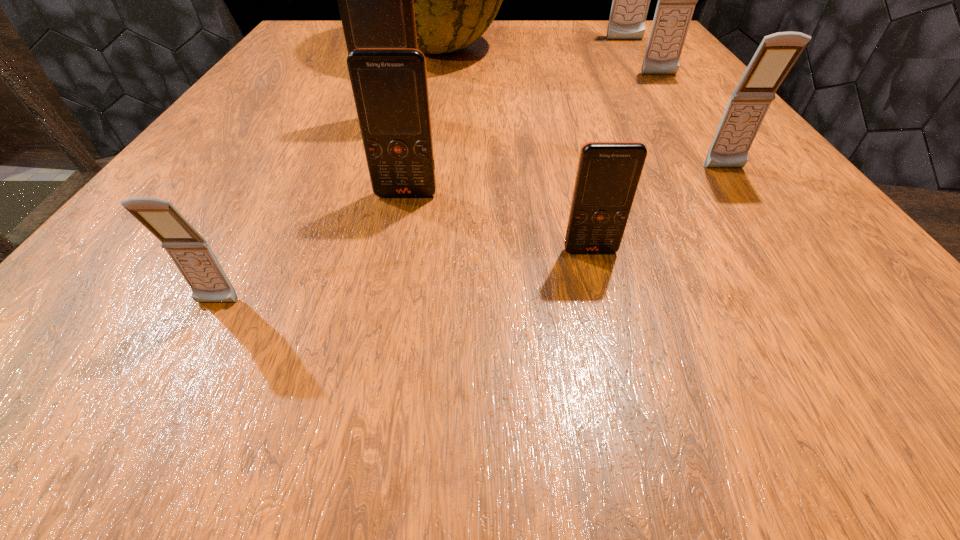
Where is `vacant space at the left edge`? The width and height of the screenshot is (960, 540). vacant space at the left edge is located at coordinates click(x=321, y=78).

At what (x,y) coordinates should I click in order to perform the action: click on vacant space at the right edge of the desktop. Please return your answer as a coordinate pair (x, y). Looking at the image, I should click on (609, 62).

In the image, there is a desktop. What are the coordinates of `free region at the far left corner` in the screenshot? It's located at (300, 42).

This screenshot has height=540, width=960. Find the location of `free space between the smallest gray cellular telephone and the third farthest gray cellular telephone`. free space between the smallest gray cellular telephone and the third farthest gray cellular telephone is located at coordinates (470, 236).

The image size is (960, 540). I want to click on empty space that is in between the tallest cellular telephone and the watermelon, so click(530, 44).

Locate an element on the screen. Image resolution: width=960 pixels, height=540 pixels. free space between the nearest orange cellular telephone and the third biggest gray cellular telephone is located at coordinates (658, 210).

Find the location of `unoccupied position between the watermelon and the fifth object from left to right`. unoccupied position between the watermelon and the fifth object from left to right is located at coordinates (513, 150).

Identify the location of free spot between the second smallest orange cellular telephone and the farthest gray cellular telephone. This screenshot has width=960, height=540. (516, 118).

Where is `free space between the farthest cellular telephone and the biggest orange cellular telephone`? free space between the farthest cellular telephone and the biggest orange cellular telephone is located at coordinates 509,80.

Where is `vacant area that lies between the sixth nearest cellular telephone and the farthest gray cellular telephone`? This screenshot has height=540, width=960. vacant area that lies between the sixth nearest cellular telephone and the farthest gray cellular telephone is located at coordinates (642, 58).